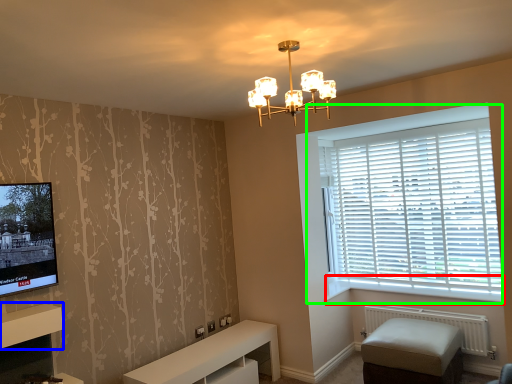
Question: Estimate the real-world distances between objects in this image. Which object is farther from window sill (highlighted by a red box), shelf (highlighted by a blue box) or window (highlighted by a green box)?

Choices:
 (A) shelf
 (B) window

Answer: (A)